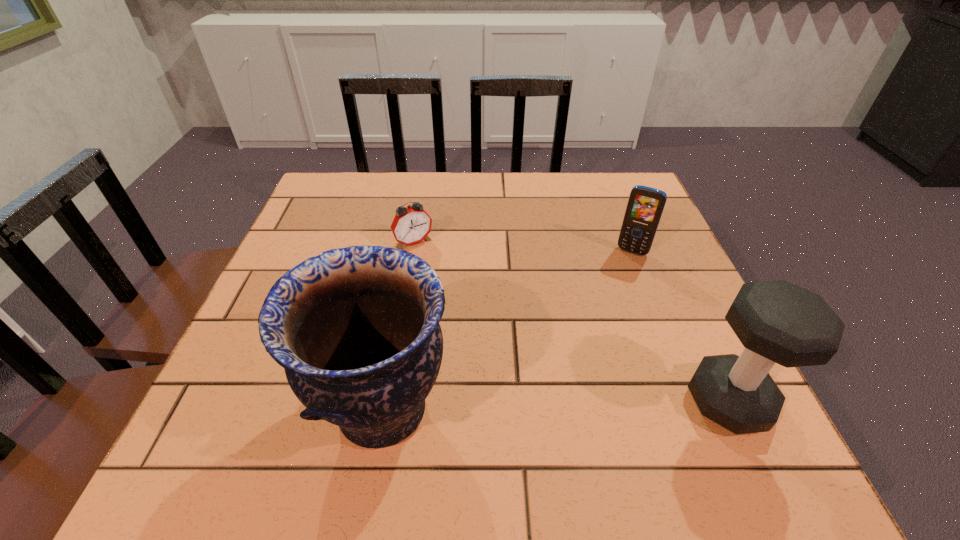
Identify the location of free area in between the dumbbell and the pottery. (556, 406).

Identify the location of free space that is in between the dumbbell and the cellular telephone. (681, 327).

In order to click on free space between the pottery and the dumbbell in this screenshot , I will do `click(556, 406)`.

Identify the location of object that can be found as the closest to the alarm clock. The width and height of the screenshot is (960, 540). click(x=356, y=329).

Locate an element on the screen. object that is the closest to the shortest object is located at coordinates (356, 329).

You are a GUI agent. You are given a task and a screenshot of the screen. Output one action in this format:
    pyautogui.click(x=<x>, y=<y>)
    Task: Click on the vacant position in the image that satisfies the following two spatial constraints: 1. on the front side of the dumbbell; 2. on the left side of the alarm clock
    The image size is (960, 540).
    Given the screenshot: What is the action you would take?
    pyautogui.click(x=387, y=401)

Locate an element on the screen. free spot that satisfies the following two spatial constraints: 1. on the front side of the shortest object; 2. on the left side of the second shortest object is located at coordinates (413, 252).